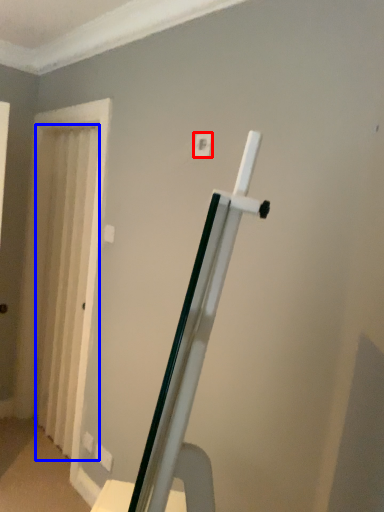
Question: Which point is further to the camera, light switch (highlighted by a red box) or curtain (highlighted by a blue box)?

Choices:
 (A) light switch
 (B) curtain

Answer: (B)